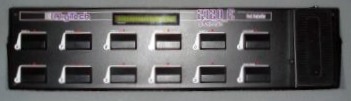
The image size is (351, 101). I want to click on small screen, so click(x=154, y=18).